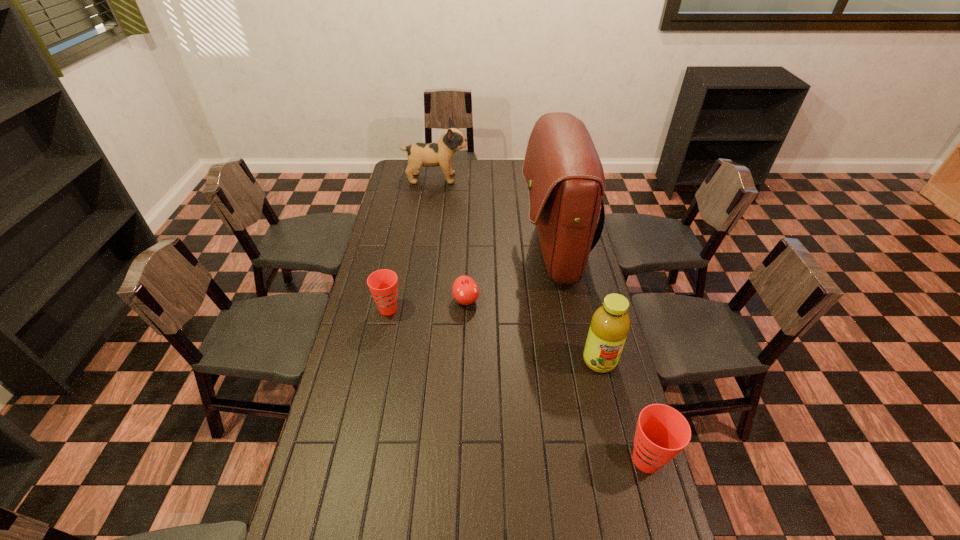
The height and width of the screenshot is (540, 960). Identify the location of empty space that is in between the nearer cup and the apple. (556, 380).

The height and width of the screenshot is (540, 960). I want to click on free space that is in between the farthest object and the tallest object, so click(x=494, y=215).

At what (x,y) coordinates should I click in order to perform the action: click on vacant point located between the shortest object and the right cup. Please return your answer as a coordinate pair (x, y). Looking at the image, I should click on (556, 380).

Identify the location of vacant space that is in between the farthest object and the apple. The image size is (960, 540). (451, 239).

Find the location of a particular element. This screenshot has height=540, width=960. object that is the fourth closest to the nearest object is located at coordinates (383, 284).

Where is `the third closest object to the farthest object`? The width and height of the screenshot is (960, 540). the third closest object to the farthest object is located at coordinates (383, 284).

I want to click on free region that satisfies the following two spatial constraints: 1. at the face of the farthest object; 2. on the right side of the shortest object, so click(x=419, y=300).

Find the location of `vacant space that satisfies the following two spatial constraints: 1. on the back side of the taller cup; 2. on the open flap of the satchel`. vacant space that satisfies the following two spatial constraints: 1. on the back side of the taller cup; 2. on the open flap of the satchel is located at coordinates (588, 252).

Find the location of a particular element. This screenshot has width=960, height=540. vacant space that satisfies the following two spatial constraints: 1. at the face of the puppy; 2. on the front side of the farther cup is located at coordinates (417, 309).